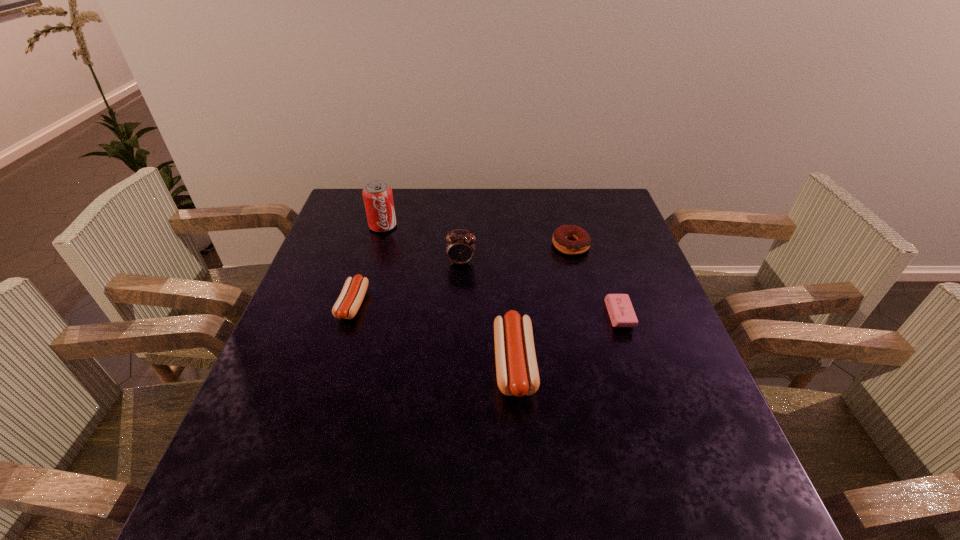
You are a GUI agent. You are given a task and a screenshot of the screen. Output one action in this format:
    pyautogui.click(x=<x>, y=<y>)
    Task: Click on the shorter sausage
    
    Given the screenshot: What is the action you would take?
    pyautogui.click(x=348, y=303)

The width and height of the screenshot is (960, 540). I want to click on the right sausage, so click(x=517, y=373).

Find the location of a particular element. Image resolution: width=960 pixels, height=540 pixels. the third object from right to left is located at coordinates (517, 373).

The width and height of the screenshot is (960, 540). Find the location of `doughnut`. doughnut is located at coordinates (582, 242).

Where is `the tallest object`? This screenshot has width=960, height=540. the tallest object is located at coordinates (378, 199).

You are a GUI agent. You are given a task and a screenshot of the screen. Output one action in this format:
    pyautogui.click(x=<x>, y=<y>)
    Task: Click on the farthest object
    The image size is (960, 540).
    Given the screenshot: What is the action you would take?
    pyautogui.click(x=378, y=199)

Locate an element on the screen. eraser is located at coordinates (620, 309).

You are a GUI agent. You are given a task and a screenshot of the screen. Output one action in this format:
    pyautogui.click(x=<x>, y=<y>)
    Task: Click on the alarm clock
    
    Given the screenshot: What is the action you would take?
    pyautogui.click(x=460, y=249)

Find the location of a particular element. the fifth shortest object is located at coordinates (460, 249).

The image size is (960, 540). Find the location of `free space located 0.370m on the back of the left sausage`. free space located 0.370m on the back of the left sausage is located at coordinates (383, 209).